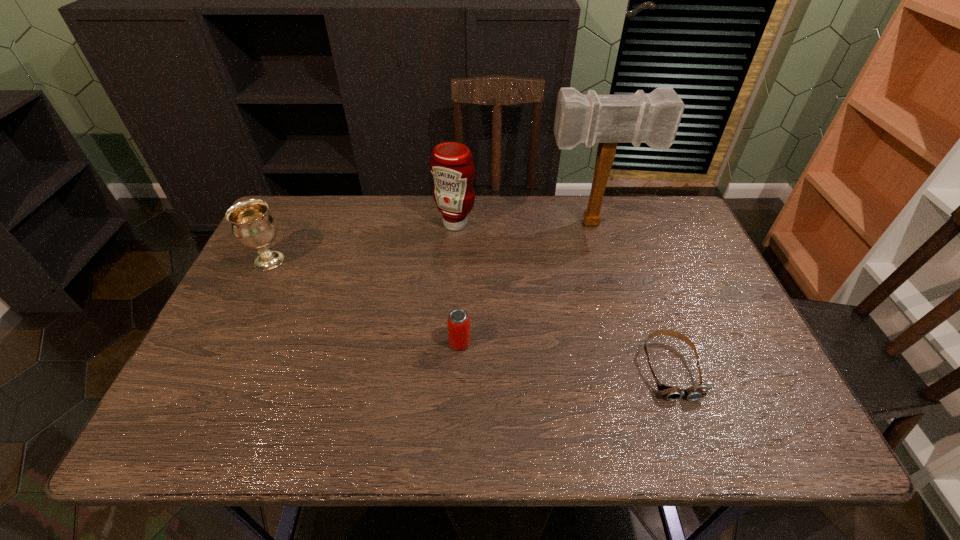
The width and height of the screenshot is (960, 540). I want to click on vacant area that lies between the fourth shortest object and the second shortest object, so click(457, 284).

I want to click on vacant space that is in between the shortest object and the beer can, so click(x=565, y=356).

You are a GUI agent. You are given a task and a screenshot of the screen. Output one action in this format:
    pyautogui.click(x=<x>, y=<y>)
    Task: Click on the vacant area between the tallest object and the fourth shortest object
    The image size is (960, 540).
    Given the screenshot: What is the action you would take?
    pyautogui.click(x=524, y=224)

Locate which object ranks third in proximity to the beer can. Please provide its 2D coordinates. Your answer should be formatted as a tuple, i.e. [(x, y)], where the tuple contains the x and y coordinates of a point satisfying the conditions above.

[(653, 119)]

I want to click on object that stands as the third closest to the leftmost object, so click(x=653, y=119).

In order to click on vacant point that satisfies the following two spatial constraints: 1. on the back side of the tallest object; 2. on the left side of the third shortest object in this screenshot , I will do `click(288, 224)`.

The height and width of the screenshot is (540, 960). Find the location of `free region that satisfies the following two spatial constraints: 1. on the back side of the tallest object; 2. on the right side of the condiment`. free region that satisfies the following two spatial constraints: 1. on the back side of the tallest object; 2. on the right side of the condiment is located at coordinates (455, 224).